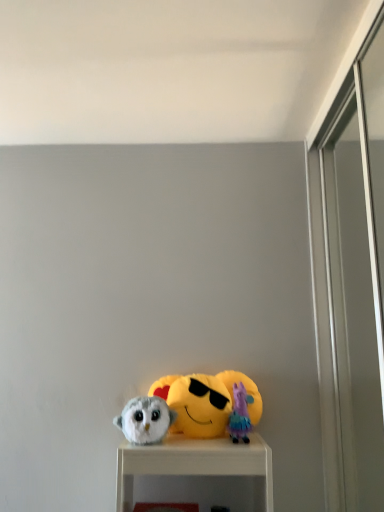
Image resolution: width=384 pixels, height=512 pixels. I want to click on plush purple at center, the first toy viewed from the right, so click(x=240, y=414).

Where is `yellow plush at center`? yellow plush at center is located at coordinates (199, 406).

The image size is (384, 512). Find the location of `plush purple at center, the first toy viewed from the right`. plush purple at center, the first toy viewed from the right is located at coordinates (240, 414).

Is point (168, 424) closer or farther from the camera than point (241, 403)?

Point (168, 424) appears to be closer to the viewer than point (241, 403).

Is fluffy white owl at lower left, the second toy when ordered from right to left, not within plush purple at center, the first toy viewed from the right?

Yes.

The height and width of the screenshot is (512, 384). I want to click on toy in front of the plush purple at center, the first toy viewed from the right, so click(x=145, y=420).

Is yellow plush at center at the left side of fluffy white owl at lower left, which is the first toy from left to right?

No, yellow plush at center is not to the left of fluffy white owl at lower left, which is the first toy from left to right.

Does yellow plush at center have a lesser width compared to fluffy white owl at lower left, the second toy when ordered from right to left?

Yes.

From the image's perspective, is yellow plush at center under fluffy white owl at lower left, the second toy when ordered from right to left?

No, from the image's perspective, yellow plush at center is not below fluffy white owl at lower left, the second toy when ordered from right to left.

Is fluffy white owl at lower left, which is the first toy from left to right, surrounded by yellow plush at center?

Actually, fluffy white owl at lower left, which is the first toy from left to right, is outside yellow plush at center.

Considering the positions of objects plush purple at center, the first toy viewed from the right, and fluffy white owl at lower left, which is the first toy from left to right, in the image provided, who is more to the right, plush purple at center, the first toy viewed from the right, or fluffy white owl at lower left, which is the first toy from left to right,?

From the viewer's perspective, plush purple at center, the first toy viewed from the right, appears more on the right side.

Can you tell me how much plush purple at center, the first toy viewed from the right, and fluffy white owl at lower left, which is the first toy from left to right, differ in facing direction?

plush purple at center, the first toy viewed from the right, and fluffy white owl at lower left, which is the first toy from left to right, are facing 2.37 degrees away from each other.

Looking at the image, does plush purple at center, the first toy viewed from the right, seem bigger or smaller compared to fluffy white owl at lower left, which is the first toy from left to right?

In the image, plush purple at center, the first toy viewed from the right, appears to be smaller than fluffy white owl at lower left, which is the first toy from left to right.

Between plush purple at center, the first toy viewed from the right, and fluffy white owl at lower left, the second toy when ordered from right to left, which one has less height?

Standing shorter between the two is fluffy white owl at lower left, the second toy when ordered from right to left.

Does plush purple at center, marked as the second toy in a left-to-right arrangement, have a larger size compared to yellow plush at center?

Actually, plush purple at center, marked as the second toy in a left-to-right arrangement, might be smaller than yellow plush at center.

Would you say plush purple at center, marked as the second toy in a left-to-right arrangement, contains yellow plush at center?

That's incorrect, yellow plush at center is not inside plush purple at center, marked as the second toy in a left-to-right arrangement.

From a real-world perspective, is plush purple at center, marked as the second toy in a left-to-right arrangement, over yellow plush at center?

No, from a real-world perspective, plush purple at center, marked as the second toy in a left-to-right arrangement, is not over yellow plush at center

Is plush purple at center, the first toy viewed from the right, placed right next to yellow plush at center?

Yes, plush purple at center, the first toy viewed from the right, is with yellow plush at center.

Between yellow plush at center and plush purple at center, the first toy viewed from the right, which one has less height?

With less height is plush purple at center, the first toy viewed from the right.

How many degrees apart are the facing directions of yellow plush at center and plush purple at center, marked as the second toy in a left-to-right arrangement?

The facing directions of yellow plush at center and plush purple at center, marked as the second toy in a left-to-right arrangement, are 4.17 degrees apart.

From the picture: Are yellow plush at center and plush purple at center, marked as the second toy in a left-to-right arrangement, located far from each other?

yellow plush at center is near plush purple at center, marked as the second toy in a left-to-right arrangement, not far away.

Considering the sizes of objects yellow plush at center and plush purple at center, marked as the second toy in a left-to-right arrangement, in the image provided, who is wider, yellow plush at center or plush purple at center, marked as the second toy in a left-to-right arrangement,?

Wider between the two is plush purple at center, marked as the second toy in a left-to-right arrangement.

Does fluffy white owl at lower left, the second toy when ordered from right to left, contain yellow plush at center?

No, yellow plush at center is located outside of fluffy white owl at lower left, the second toy when ordered from right to left.

Consider the image. From the image's perspective, is fluffy white owl at lower left, the second toy when ordered from right to left, on yellow plush at center?

Actually, fluffy white owl at lower left, the second toy when ordered from right to left, appears below yellow plush at center in the image.

Looking at this image, considering the relative sizes of fluffy white owl at lower left, the second toy when ordered from right to left, and yellow plush at center in the image provided, is fluffy white owl at lower left, the second toy when ordered from right to left, thinner than yellow plush at center?

No, fluffy white owl at lower left, the second toy when ordered from right to left, is not thinner than yellow plush at center.

Looking at this image, is fluffy white owl at lower left, which is the first toy from left to right, facing away from yellow plush at center?

No, fluffy white owl at lower left, which is the first toy from left to right, is not facing away from yellow plush at center.

Locate an element on the screen. Image resolution: width=384 pixels, height=512 pixels. toy below the plush purple at center, marked as the second toy in a left-to-right arrangement (from the image's perspective) is located at coordinates (145, 420).

What are the coordinates of `face to the right of fluffy white owl at lower left, which is the first toy from left to right` in the screenshot? It's located at (199, 406).

Considering their positions, is yellow plush at center positioned closer to fluffy white owl at lower left, which is the first toy from left to right, than plush purple at center, the first toy viewed from the right?

yellow plush at center is positioned closer to the anchor fluffy white owl at lower left, which is the first toy from left to right.

Which object lies further to the anchor point plush purple at center, marked as the second toy in a left-to-right arrangement, fluffy white owl at lower left, the second toy when ordered from right to left, or yellow plush at center?

The object further to plush purple at center, marked as the second toy in a left-to-right arrangement, is fluffy white owl at lower left, the second toy when ordered from right to left.

From the image, which object appears to be farther from fluffy white owl at lower left, the second toy when ordered from right to left, plush purple at center, marked as the second toy in a left-to-right arrangement, or yellow plush at center?

The object further to fluffy white owl at lower left, the second toy when ordered from right to left, is plush purple at center, marked as the second toy in a left-to-right arrangement.

Considering their positions, is yellow plush at center positioned further to plush purple at center, the first toy viewed from the right, than fluffy white owl at lower left, the second toy when ordered from right to left?

fluffy white owl at lower left, the second toy when ordered from right to left, is positioned further to the anchor plush purple at center, the first toy viewed from the right.

When comparing their distances from yellow plush at center, does fluffy white owl at lower left, the second toy when ordered from right to left, or plush purple at center, marked as the second toy in a left-to-right arrangement, seem closer?

plush purple at center, marked as the second toy in a left-to-right arrangement.

Considering their positions, is plush purple at center, the first toy viewed from the right, positioned further to yellow plush at center than fluffy white owl at lower left, which is the first toy from left to right?

fluffy white owl at lower left, which is the first toy from left to right, is further to yellow plush at center.

Identify the location of face situated between fluffy white owl at lower left, the second toy when ordered from right to left, and plush purple at center, marked as the second toy in a left-to-right arrangement, from left to right. (199, 406).